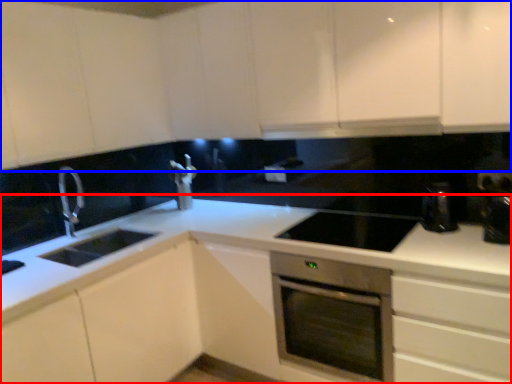
Question: Which of the following is the farthest to the observer, countertop (highlighted by a red box) or cabinetry (highlighted by a blue box)?

Choices:
 (A) countertop
 (B) cabinetry

Answer: (A)